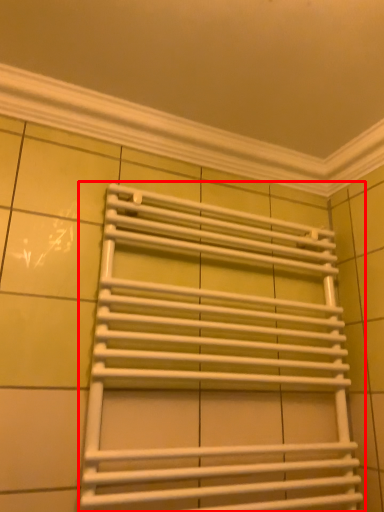
Question: From the image, what is the correct spatial relationship of towel rack (annotated by the red box) in relation to window frame?

Choices:
 (A) right
 (B) left

Answer: (A)